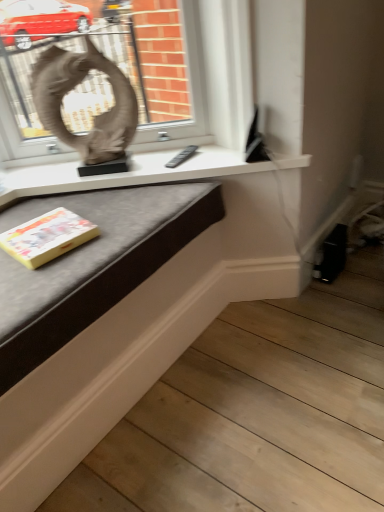
Question: Can we say matte white table at center lies outside yellow paper at lower left?

Choices:
 (A) no
 (B) yes

Answer: (B)

Question: From a real-world perspective, does matte white table at center sit lower than yellow paper at lower left?

Choices:
 (A) no
 (B) yes

Answer: (A)

Question: Is matte white table at center smaller than yellow paper at lower left?

Choices:
 (A) yes
 (B) no

Answer: (B)

Question: Does matte white table at center appear on the left side of yellow paper at lower left?

Choices:
 (A) no
 (B) yes

Answer: (A)

Question: Considering the relative sizes of matte white table at center and yellow paper at lower left in the image provided, is matte white table at center wider than yellow paper at lower left?

Choices:
 (A) no
 (B) yes

Answer: (B)

Question: Is point (89, 150) positioned closer to the camera than point (69, 238)?

Choices:
 (A) closer
 (B) farther

Answer: (B)

Question: Considering the relative positions of matte gray sculpture at upper left and yellow paper at lower left in the image provided, is matte gray sculpture at upper left to the left or to the right of yellow paper at lower left?

Choices:
 (A) right
 (B) left

Answer: (A)

Question: From a real-world perspective, is matte gray sculpture at upper left positioned above or below yellow paper at lower left?

Choices:
 (A) below
 (B) above

Answer: (B)

Question: From the image's perspective, is matte gray sculpture at upper left positioned above or below yellow paper at lower left?

Choices:
 (A) below
 (B) above

Answer: (B)

Question: From their relative heights in the image, would you say yellow paper at lower left is taller or shorter than matte gray sculpture at upper left?

Choices:
 (A) short
 (B) tall

Answer: (A)

Question: From a real-world perspective, is yellow paper at lower left physically located above or below matte gray sculpture at upper left?

Choices:
 (A) above
 (B) below

Answer: (B)

Question: Looking at their shapes, would you say yellow paper at lower left is wider or thinner than matte gray sculpture at upper left?

Choices:
 (A) wide
 (B) thin

Answer: (A)

Question: Is yellow paper at lower left to the left or to the right of matte gray sculpture at upper left in the image?

Choices:
 (A) left
 (B) right

Answer: (A)

Question: Considering the positions of yellow paper at lower left and matte white table at center in the image, is yellow paper at lower left taller or shorter than matte white table at center?

Choices:
 (A) tall
 (B) short

Answer: (B)

Question: From a real-world perspective, is yellow paper at lower left physically located above or below matte white table at center?

Choices:
 (A) below
 (B) above

Answer: (A)